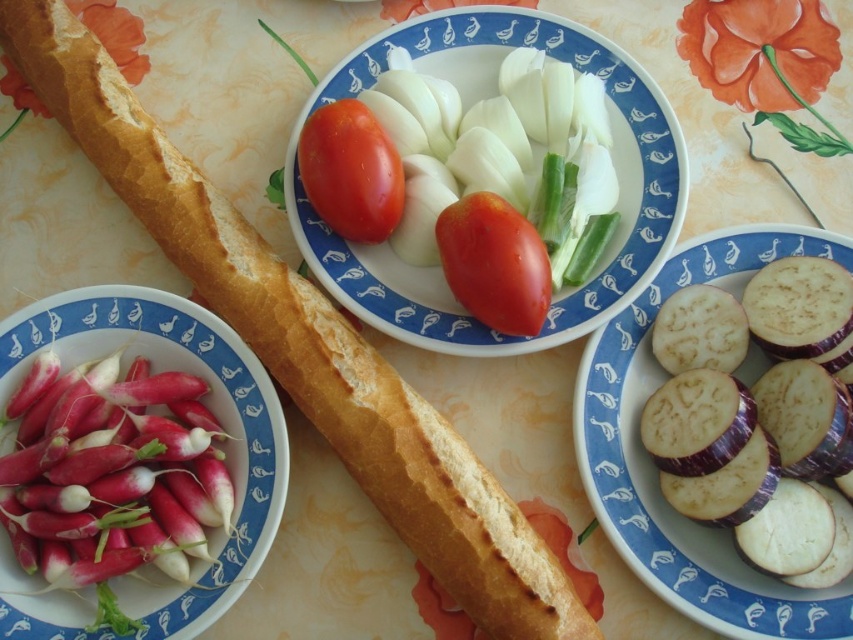
Where is the golden crusty baguette at center located in the image?

The golden crusty baguette at center is located at point [305,344].

You are standing at the center of the table and want to place a small dish at the point labeled as point (305, 344). Which object is located at that coordinate?

The point (305, 344) is on the golden crusty baguette at center.